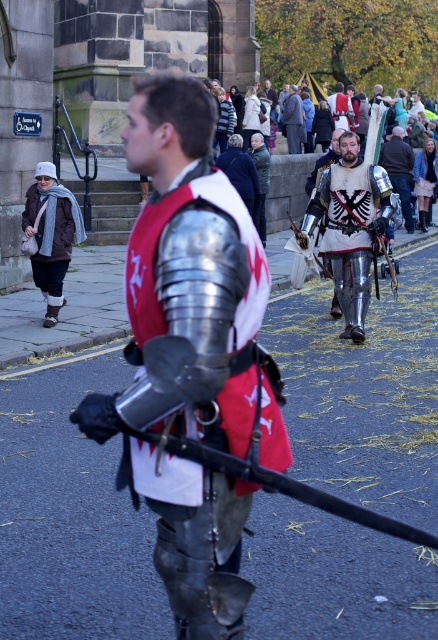
You are planning to rent a costume for a medieval festival. You want to choose between the silver metallic armor at center and the matte gray suit at center. Based on the scene description, which one is larger in size?

The silver metallic armor at center is bigger than the matte gray suit at center, so the silver metallic armor at center is the larger option available.

You are standing at the center of the paved street and see the point at coordinates [52,218]. Which object is this point located on?

The point at coordinates [52,218] is located on the brown leather jacket at left.

You are standing in the crowd watching the historical reenactment. You want to take a photo of both the silver metallic armor at center and the matte gray suit at center. Which one should you focus on first to ensure both are in focus?

You should focus on the silver metallic armor at center first because it is closer to the viewer than the matte gray suit at center, so adjusting focus from near to far will help both be in focus.